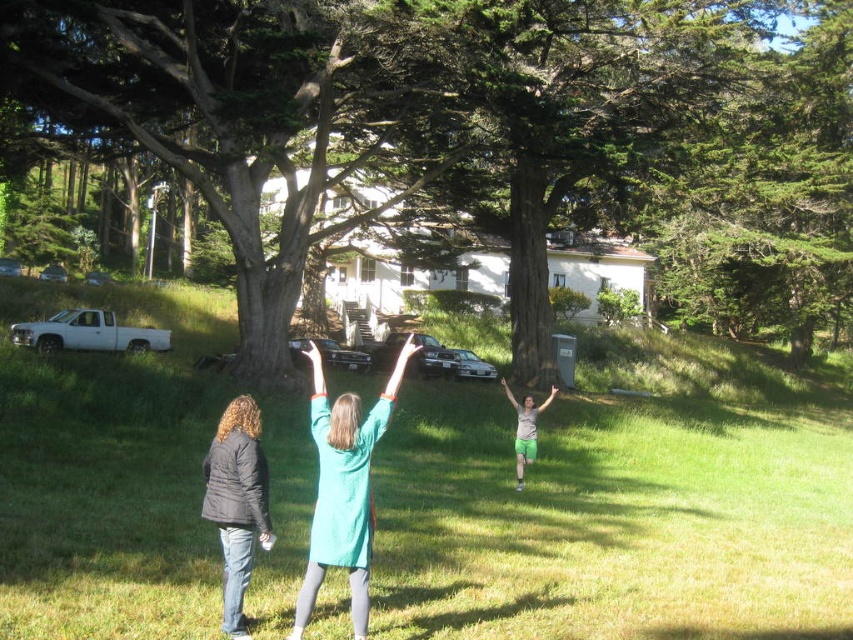
You are planning to take a photo of the black puffy jacket at lower left and the green textured tree at center. Which object should you focus on first if you want to capture both in sharp focus?

The green textured tree at center is bigger than the black puffy jacket at lower left, so you should focus on the green textured tree at center first to ensure both are in sharp focus.

You are planning to place a small garden statue on the green grass at center and green fabric pants at center. Which surface is more suitable for the statue based on their widths?

The green grass at center is wider than the green fabric pants at center, so it is more suitable for placing the statue.